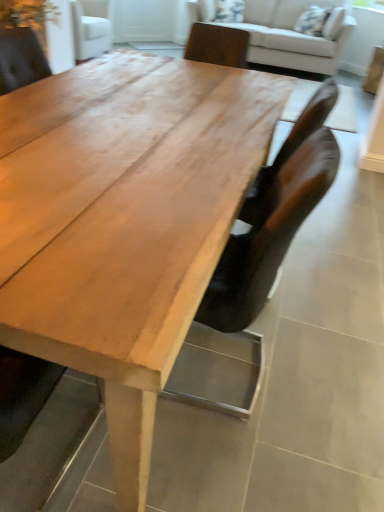
The image size is (384, 512). I want to click on light brown wood table at center, so click(x=124, y=221).

Where is `brown leather chair at center`? The height and width of the screenshot is (512, 384). brown leather chair at center is located at coordinates (249, 287).

Is light beige fabric couch at upper center oriented towards brown leather chair at center?

Yes, light beige fabric couch at upper center is oriented towards brown leather chair at center.

How many degrees apart are the facing directions of light beige fabric couch at upper center and brown leather chair at center?

They differ by 89.6 degrees in their facing directions.

What are the coordinates of `studio couch that is above the brown leather chair at center (from the image's perspective)` in the screenshot? It's located at (295, 35).

From a real-world perspective, does light beige fabric couch at upper center stand above brown leather chair at center?

Indeed, from a real-world perspective, light beige fabric couch at upper center stands above brown leather chair at center.

Which object is positioned more to the left, light brown wood table at center or light beige fabric couch at upper center?

light brown wood table at center is more to the left.

Considering the sizes of light brown wood table at center and light beige fabric couch at upper center in the image, is light brown wood table at center taller or shorter than light beige fabric couch at upper center?

Considering their sizes, light brown wood table at center has less height than light beige fabric couch at upper center.

How distant is light brown wood table at center from light beige fabric couch at upper center?

light brown wood table at center is 3.25 meters away from light beige fabric couch at upper center.

Does point (144, 505) appear closer or farther from the camera than point (308, 4)?

Point (144, 505) is closer to the camera than point (308, 4).

Is point (274, 48) positioned before point (130, 241)?

No, (274, 48) is behind (130, 241).

What's the angular difference between light beige fabric couch at upper center and light brown wood table at center's facing directions?

The facing directions of light beige fabric couch at upper center and light brown wood table at center are 0.309 degrees apart.

Is light beige fabric couch at upper center situated inside light brown wood table at center or outside?

light beige fabric couch at upper center is not inside light brown wood table at center, it's outside.

From the image's perspective, which one is positioned lower, light brown wood table at center or brown leather chair at center?

brown leather chair at center is shown below in the image.

Who is shorter, light brown wood table at center or brown leather chair at center?

light brown wood table at center is shorter.

Are light brown wood table at center and brown leather chair at center far apart?

light brown wood table at center is near brown leather chair at center, not far away.

From a real-world perspective, who is located lower, light brown wood table at center or brown leather chair at center?

From a 3D spatial view, light brown wood table at center is below.

Can you see brown leather chair at center touching light beige fabric couch at upper center?

No, brown leather chair at center is not touching light beige fabric couch at upper center.

Consider the image. Measure the distance from brown leather chair at center to light beige fabric couch at upper center.

brown leather chair at center and light beige fabric couch at upper center are 3.67 meters apart from each other.

Who is smaller, brown leather chair at center or light beige fabric couch at upper center?

brown leather chair at center.

Would you say brown leather chair at center is outside light beige fabric couch at upper center?

Indeed, brown leather chair at center is completely outside light beige fabric couch at upper center.

From the picture: Who is shorter, brown leather chair at center or light brown wood table at center?

light brown wood table at center is shorter.

Can we say brown leather chair at center lies outside light brown wood table at center?

No, brown leather chair at center is not outside of light brown wood table at center.

Find the location of a particular element. This screenshot has height=512, width=384. chair below the light brown wood table at center (from the image's perspective) is located at coordinates (249, 287).

From the image's perspective, which object appears higher, brown leather chair at center or light brown wood table at center?

light brown wood table at center appears higher in the image.

The height and width of the screenshot is (512, 384). What are the coordinates of `chair in front of the light beige fabric couch at upper center` in the screenshot? It's located at (249, 287).

This screenshot has height=512, width=384. What are the coordinates of `coffee table below the light beige fabric couch at upper center (from the image's perspective)` in the screenshot? It's located at (124, 221).

Looking at the image, which one is located further to light brown wood table at center, light beige fabric couch at upper center or brown leather chair at center?

light beige fabric couch at upper center is positioned further to the anchor light brown wood table at center.

When comparing their distances from brown leather chair at center, does light beige fabric couch at upper center or light brown wood table at center seem closer?

light brown wood table at center is closer to brown leather chair at center.

Looking at the image, which one is located closer to light beige fabric couch at upper center, brown leather chair at center or light brown wood table at center?

The object closer to light beige fabric couch at upper center is light brown wood table at center.

Estimate the real-world distances between objects in this image. Which object is further from light brown wood table at center, brown leather chair at center or light beige fabric couch at upper center?

light beige fabric couch at upper center.

Based on their spatial positions, is light brown wood table at center or light beige fabric couch at upper center further from brown leather chair at center?

light beige fabric couch at upper center.

Looking at the image, which one is located further to light beige fabric couch at upper center, light brown wood table at center or brown leather chair at center?

brown leather chair at center is positioned further to the anchor light beige fabric couch at upper center.

Find the location of a particular element. The height and width of the screenshot is (512, 384). chair positioned between light brown wood table at center and light beige fabric couch at upper center from near to far is located at coordinates (249, 287).